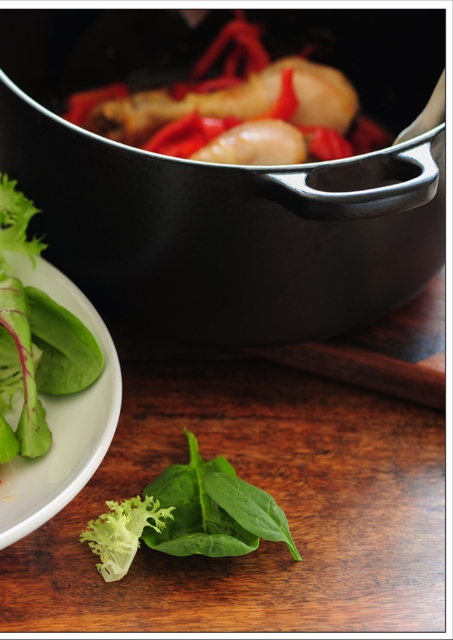
Question: Which object is closer to the camera taking this photo?

Choices:
 (A) green leafy at lower left
 (B) black matte frying pan at upper center
 (C) green leafy plate at lower left

Answer: (C)

Question: Observing the image, what is the correct spatial positioning of green leafy at lower left in reference to green leafy plate at lower left?

Choices:
 (A) below
 (B) above

Answer: (A)

Question: Among these objects, which one is farthest from the camera?

Choices:
 (A) green leafy at lower left
 (B) green leafy plate at lower left
 (C) black matte frying pan at upper center

Answer: (A)

Question: Does black matte frying pan at upper center appear under green leafy at lower left?

Choices:
 (A) no
 (B) yes

Answer: (A)

Question: Which point is closer to the camera?

Choices:
 (A) (184, 433)
 (B) (107, 29)

Answer: (A)

Question: Does black matte frying pan at upper center appear over green leafy plate at lower left?

Choices:
 (A) yes
 (B) no

Answer: (A)